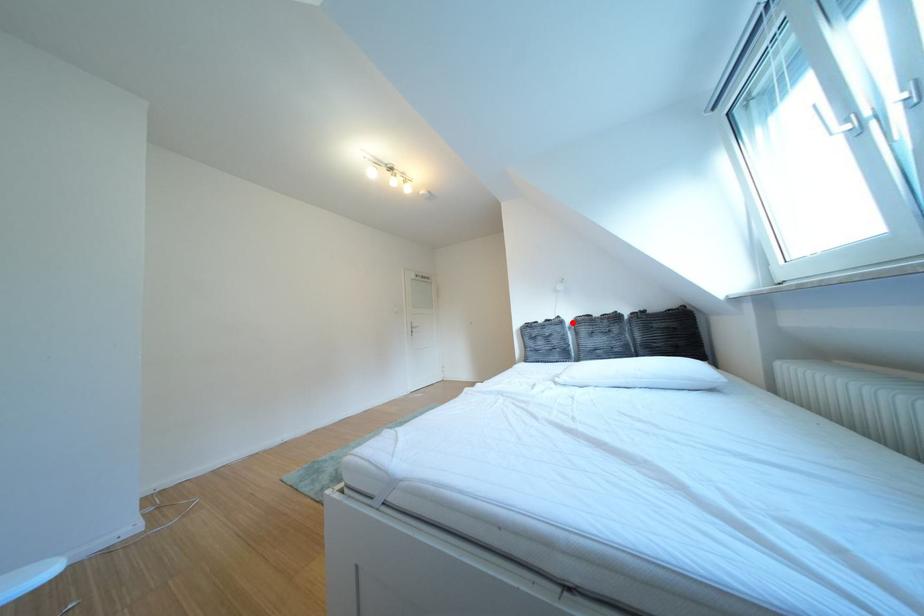
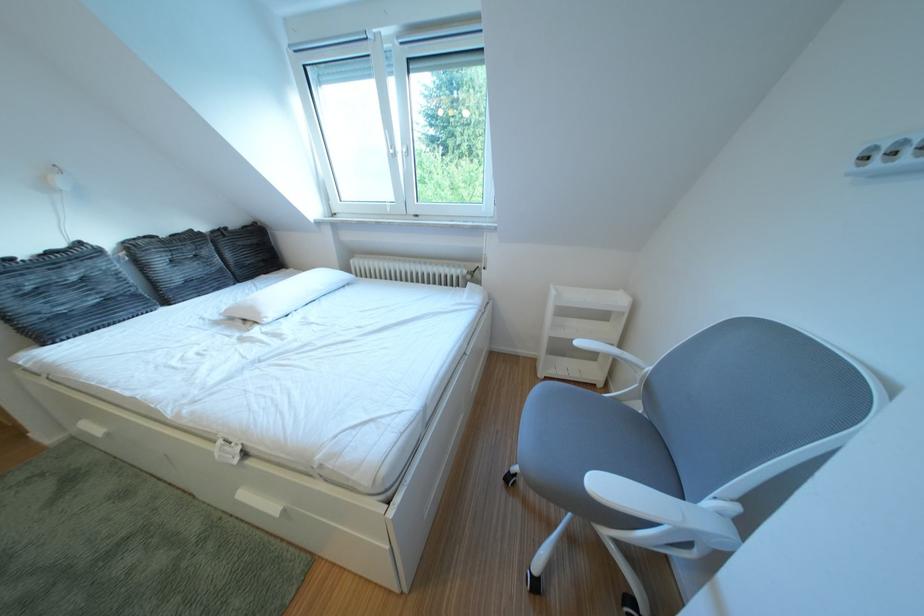
Find the pixel in the second image that matches the highlighted location in the first image.

(93, 249)